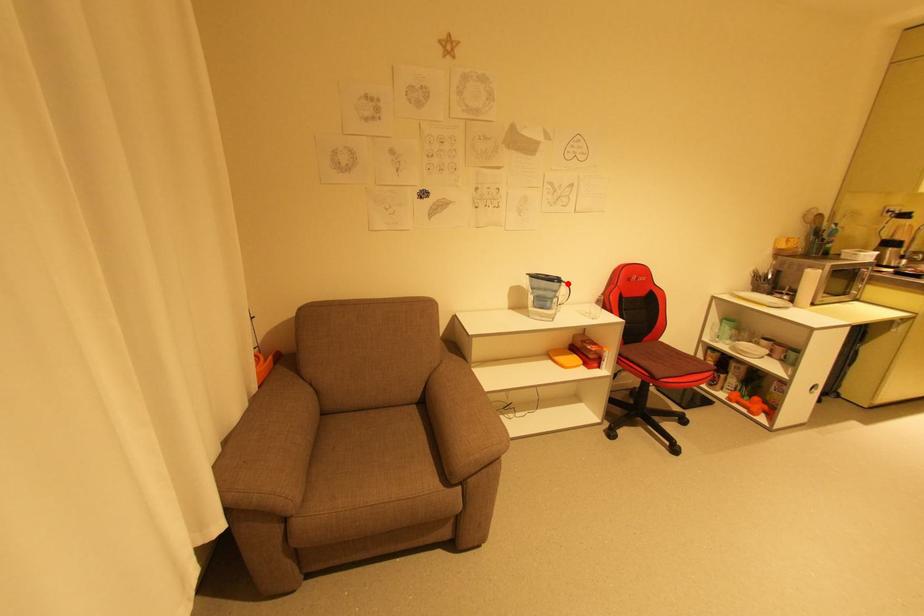
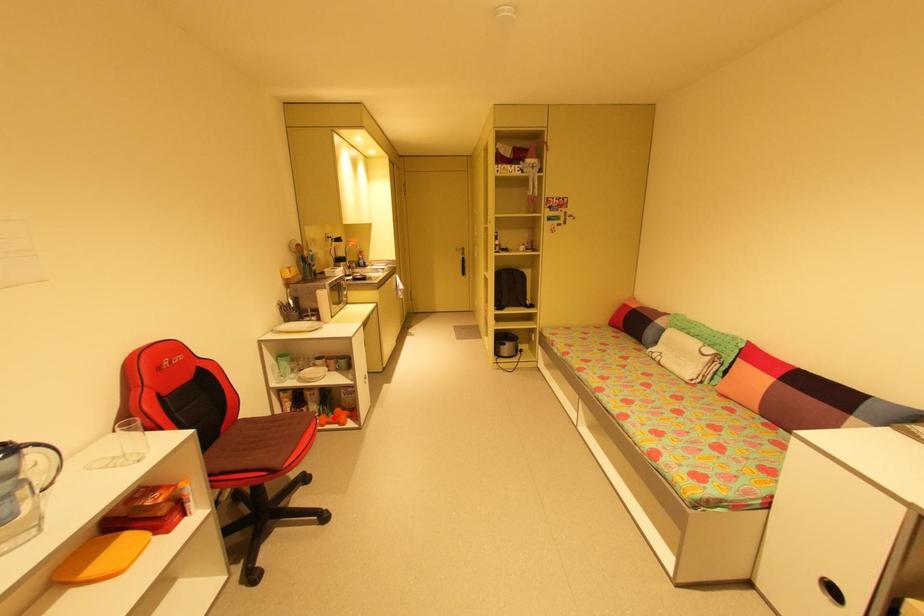
I am providing you with two images of the same scene from different viewpoints. A red point is marked on the first image and another point is marked on the second image. Is the red point in image1 aligned with the point shown in image2?

No